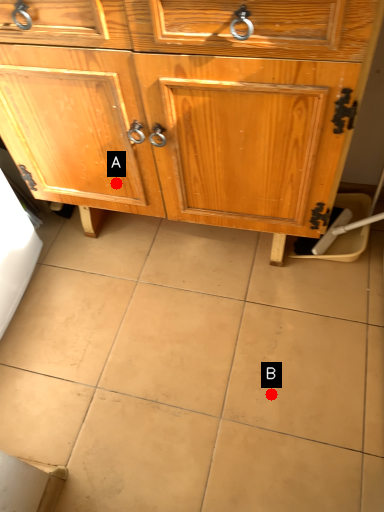
Question: Two points are circled on the image, labeled by A and B beside each circle. Which point is closer to the camera?

Choices:
 (A) A is closer
 (B) B is closer

Answer: (B)